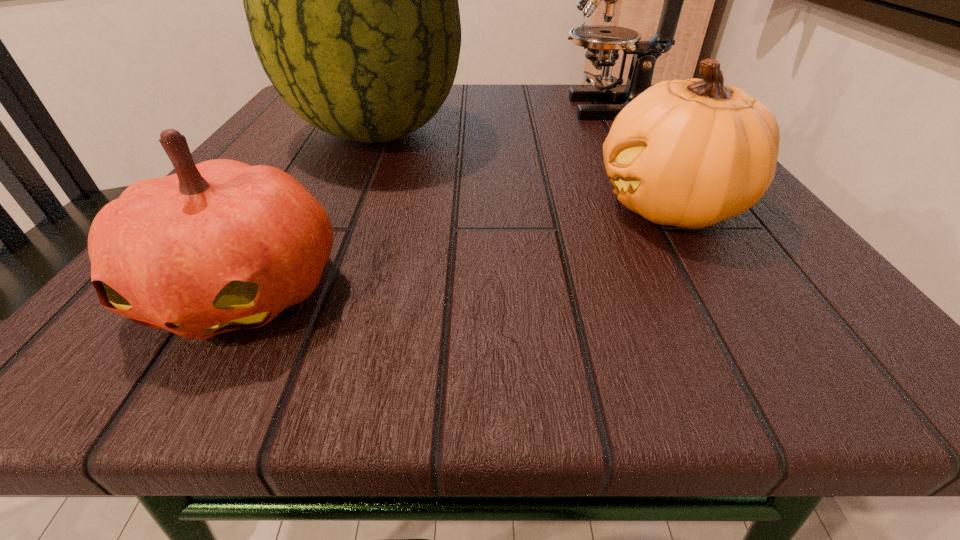
Locate an element on the screen. The width and height of the screenshot is (960, 540). unoccupied position between the left pumpkin and the right pumpkin is located at coordinates (456, 248).

This screenshot has width=960, height=540. In order to click on vacant space that's between the microscope and the left pumpkin in this screenshot , I will do `click(429, 199)`.

Identify the location of free spot between the microscope and the left pumpkin. The height and width of the screenshot is (540, 960). (429, 199).

Identify the location of the closest object relative to the right pumpkin. (351, 0).

Where is `object that stands as the second closest to the left pumpkin`? object that stands as the second closest to the left pumpkin is located at coordinates (690, 153).

Locate an element on the screen. The height and width of the screenshot is (540, 960). free space that satisfies the following two spatial constraints: 1. on the front face of the right pumpkin; 2. on the front-facing side of the left pumpkin is located at coordinates (721, 290).

The height and width of the screenshot is (540, 960). Identify the location of free space that satisfies the following two spatial constraints: 1. on the front face of the right pumpkin; 2. on the front-facing side of the left pumpkin. (721, 290).

Find the location of a particular element. vacant region that satisfies the following two spatial constraints: 1. at the eyepiece of the microscope; 2. on the front-facing side of the left pumpkin is located at coordinates (731, 290).